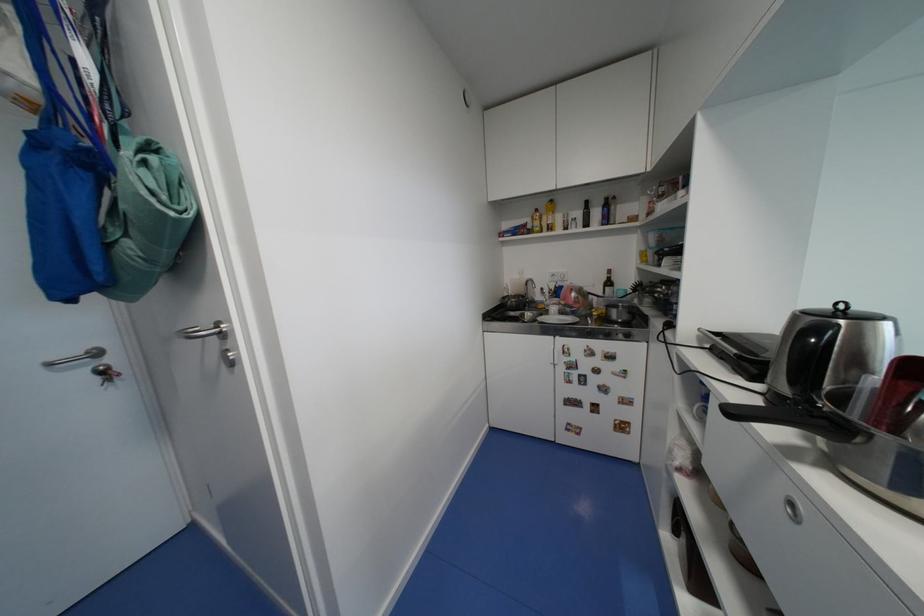
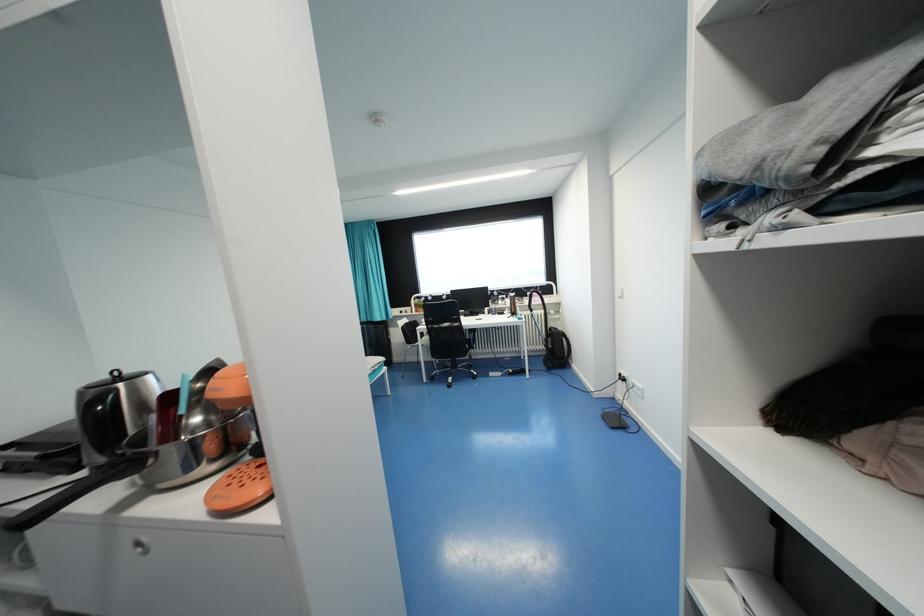
Find the pixel in the second image that matches (x=796, y=505) in the first image.

(142, 545)